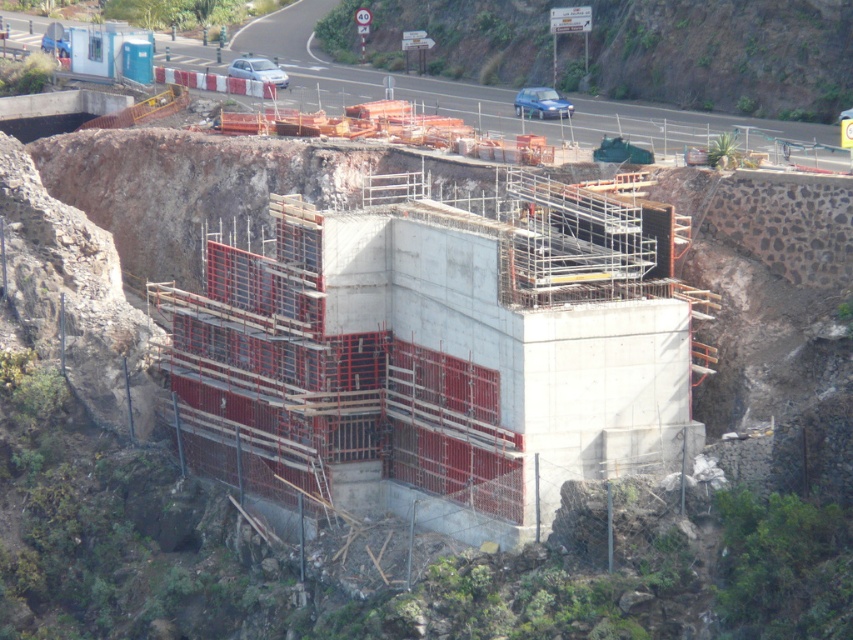
Question: Can you confirm if concrete at center is positioned to the right of green mossy rock at upper center?

Choices:
 (A) yes
 (B) no

Answer: (B)

Question: Is concrete at center to the left of green mossy rock at upper center from the viewer's perspective?

Choices:
 (A) yes
 (B) no

Answer: (A)

Question: Which point is closer to the camera?

Choices:
 (A) (792, 134)
 (B) (410, 0)

Answer: (A)

Question: Does concrete at center appear under green mossy rock at upper center?

Choices:
 (A) yes
 (B) no

Answer: (B)

Question: Which point is closer to the camera?

Choices:
 (A) green mossy rock at upper center
 (B) concrete at center

Answer: (B)